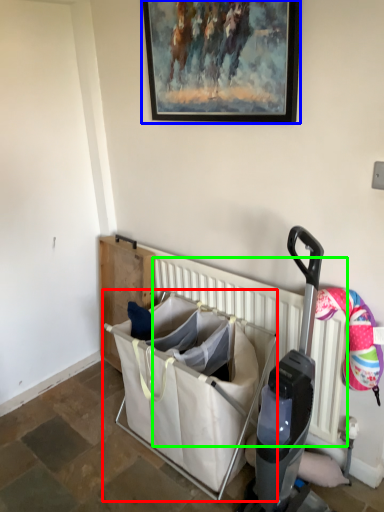
Question: Based on their relative distances, which object is farther from baby carriage (highlighted by a red box)? Choose from picture frame (highlighted by a blue box) and radiator (highlighted by a green box).

Choices:
 (A) picture frame
 (B) radiator

Answer: (A)